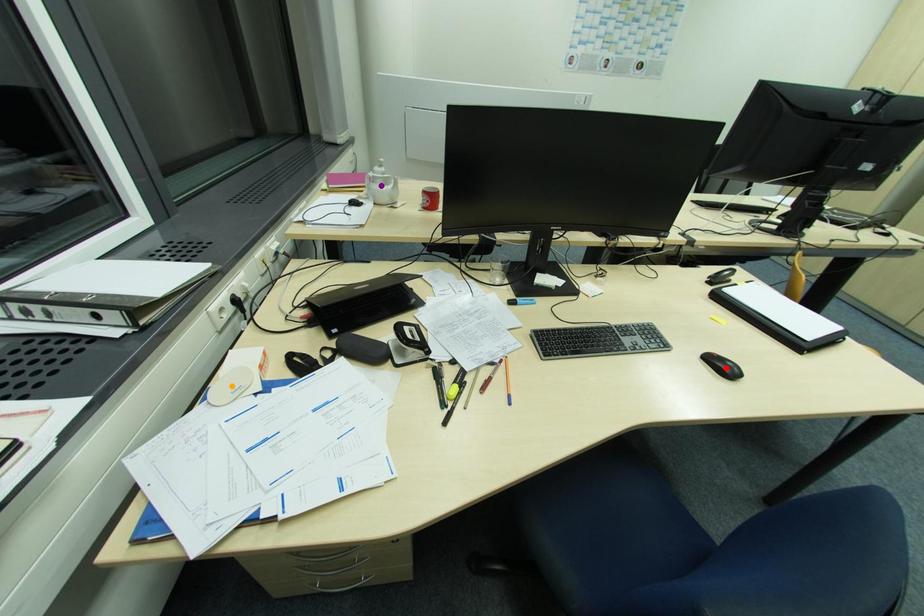
Order these from farthest to nearest:
purple point | orange point | red point

1. purple point
2. red point
3. orange point